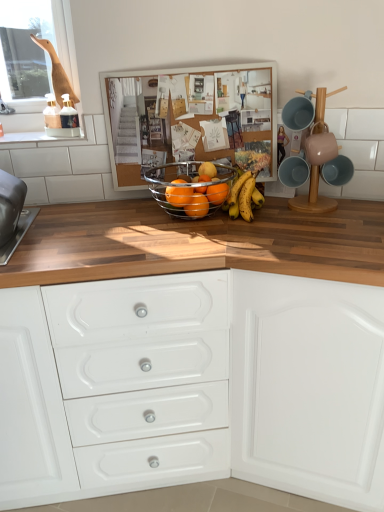
Locate an element on the screen. vacant space in front of matte blue cup at upper right is located at coordinates (323, 224).